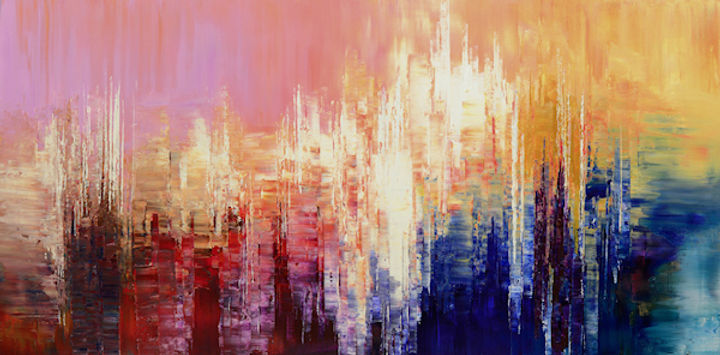
Image resolution: width=720 pixels, height=355 pixels. Identify the location of canvas. click(564, 65).